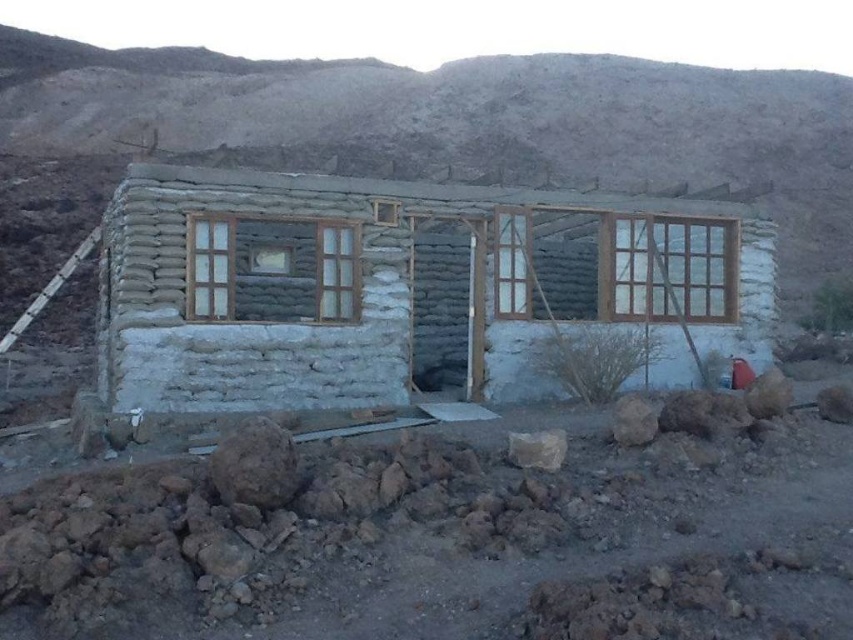
You are an architect designing a new structure in a desert environment. You have a white mud hut at center and a clear glass door at center in your design. Which of these two elements is wider?

The white mud hut at center is wider than the clear glass door at center according to the description.

Consider the image. You are a traveler in the desert and need to enter the building. You see the white mud hut at center and the clear glass door at center. Which one should you approach to enter the building?

The clear glass door at center is the entrance, so you should approach the clear glass door at center to enter the building.